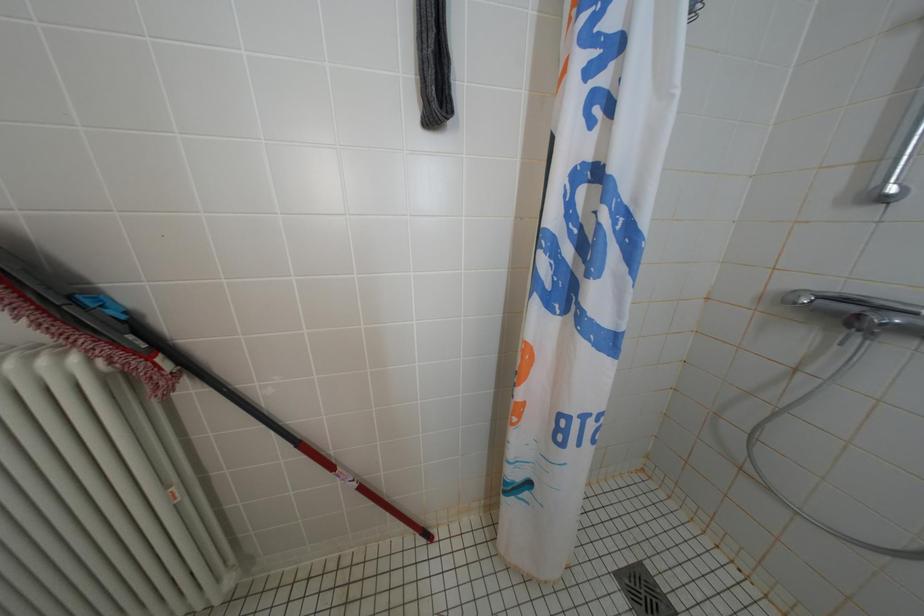
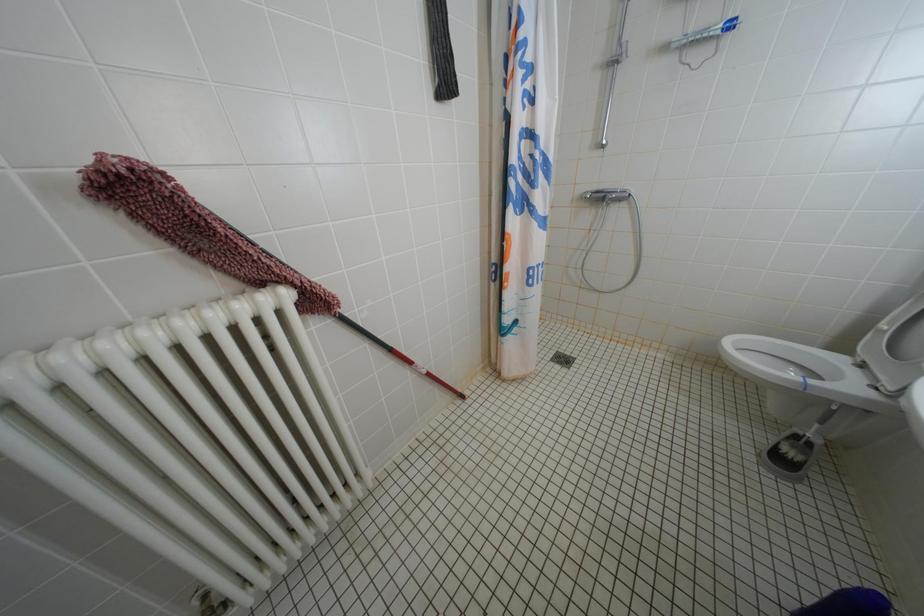
Question: The camera is either moving clockwise (left) or counter-clockwise (right) around the object. The first image is from the beginning of the video and the second image is from the end. Is the camera moving left or right when shooting the video?

Choices:
 (A) Left
 (B) Right

Answer: (A)